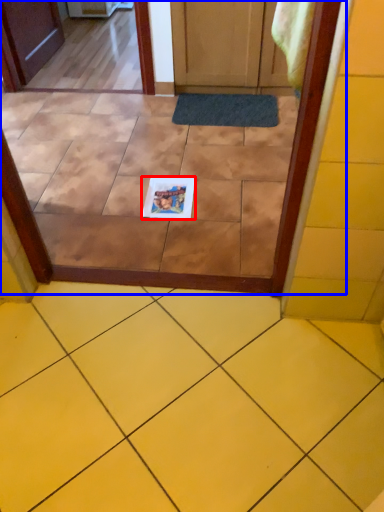
Question: Among these objects, which one is farthest to the camera, copy (highlighted by a red box) or glass door (highlighted by a blue box)?

Choices:
 (A) copy
 (B) glass door

Answer: (A)